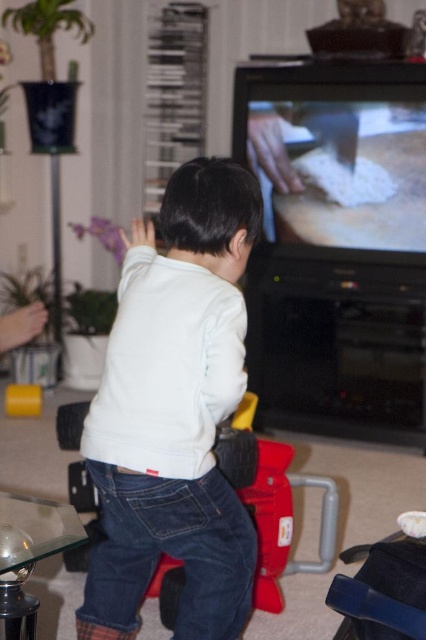
What do you see at coordinates (175, 412) in the screenshot? Image resolution: width=426 pixels, height=640 pixels. I see `white matte shirt at center` at bounding box center [175, 412].

The image size is (426, 640). Describe the element at coordinates (175, 412) in the screenshot. I see `white matte shirt at center` at that location.

In order to click on white matte shirt at center in this screenshot , I will do `click(175, 412)`.